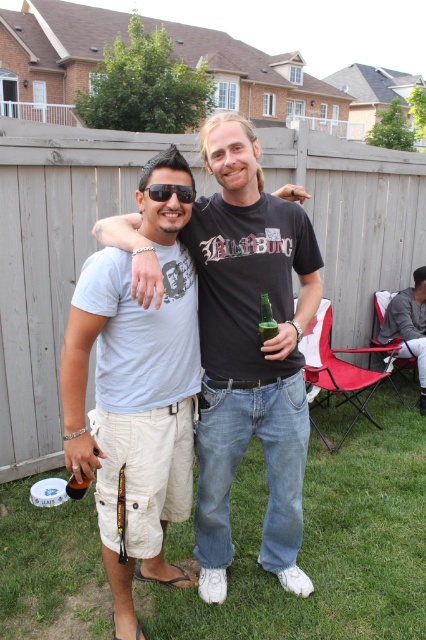
You are standing at the origin of the coordinate system in the image. You want to walk to the point at the bottom right corner of the image. Which point, point at (317,241) or point at (69,486), is closer to your starting position?

Point at (69,486) is closer to the origin because it has a smaller y coordinate and a larger x coordinate, so it is closer to the bottom right corner than point at (317,241).